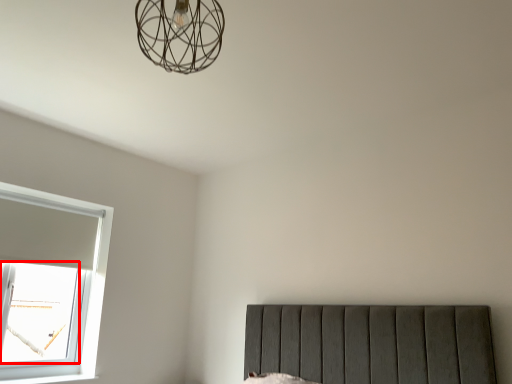
Question: From the image, what is the correct spatial relationship of window screen (annotated by the red box) in relation to lamp?

Choices:
 (A) right
 (B) left

Answer: (B)